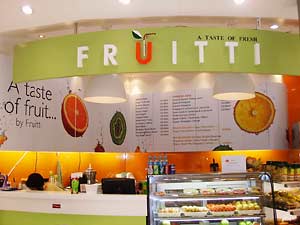
The image size is (300, 225). In order to click on lights in this screenshot , I will do `click(26, 7)`, `click(125, 0)`, `click(240, 0)`, `click(240, 91)`, `click(106, 92)`.